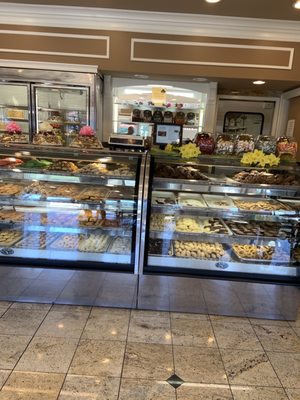
Identify the location of door. (264, 112).